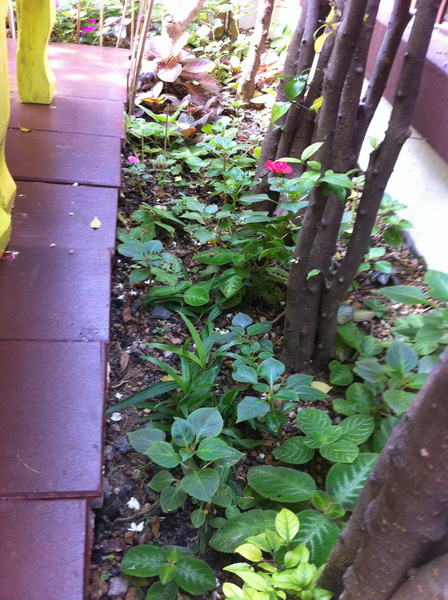
This screenshot has height=600, width=448. Identify the location of furniture leg. (34, 52), (4, 188), (4, 215), (4, 107).